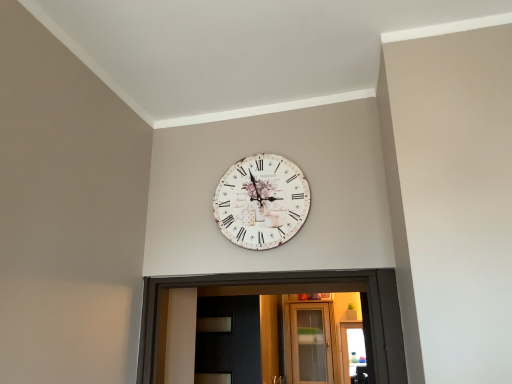
Question: Does clear glass door at center have a larger size compared to vintage paper clock at center?

Choices:
 (A) no
 (B) yes

Answer: (B)

Question: Is the depth of clear glass door at center greater than that of vintage paper clock at center?

Choices:
 (A) yes
 (B) no

Answer: (A)

Question: Is clear glass door at center thinner than vintage paper clock at center?

Choices:
 (A) yes
 (B) no

Answer: (B)

Question: Can you see clear glass door at center touching vintage paper clock at center?

Choices:
 (A) yes
 (B) no

Answer: (B)

Question: Is clear glass door at center facing away from vintage paper clock at center?

Choices:
 (A) no
 (B) yes

Answer: (A)

Question: From the image's perspective, does clear glass door at center appear lower than vintage paper clock at center?

Choices:
 (A) no
 (B) yes

Answer: (B)

Question: Does vintage paper clock at center lie behind clear glass door at center?

Choices:
 (A) yes
 (B) no

Answer: (B)

Question: Is vintage paper clock at center closer to the viewer compared to clear glass door at center?

Choices:
 (A) no
 (B) yes

Answer: (B)

Question: Does vintage paper clock at center have a greater width compared to clear glass door at center?

Choices:
 (A) yes
 (B) no

Answer: (B)

Question: Is vintage paper clock at center turned away from clear glass door at center?

Choices:
 (A) yes
 (B) no

Answer: (A)

Question: Is vintage paper clock at center to the right of clear glass door at center from the viewer's perspective?

Choices:
 (A) no
 (B) yes

Answer: (A)

Question: Considering the relative sizes of vintage paper clock at center and clear glass door at center in the image provided, is vintage paper clock at center thinner than clear glass door at center?

Choices:
 (A) no
 (B) yes

Answer: (B)

Question: Considering the positions of clear glass door at center and vintage paper clock at center in the image, is clear glass door at center taller or shorter than vintage paper clock at center?

Choices:
 (A) short
 (B) tall

Answer: (B)